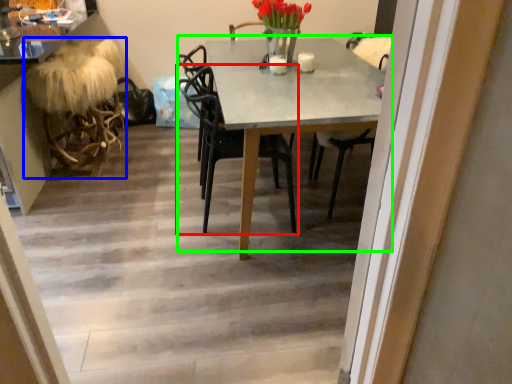
Question: Estimate the real-world distances between objects in this image. Which object is farther from chair (highlighted by a red box), rocking chair (highlighted by a blue box) or kitchen & dining room table (highlighted by a green box)?

Choices:
 (A) rocking chair
 (B) kitchen & dining room table

Answer: (A)